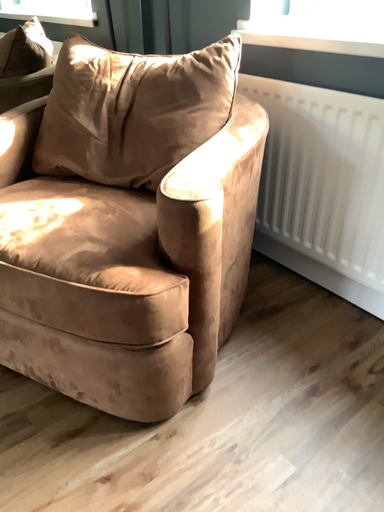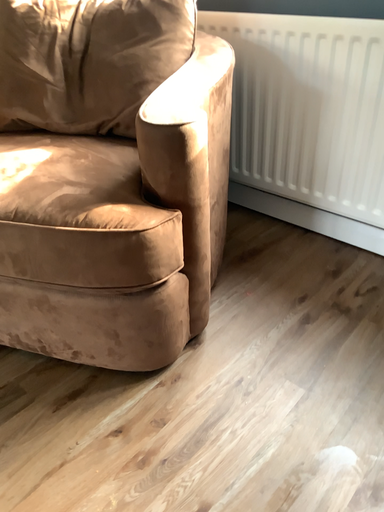
Question: How did the camera likely rotate when shooting the video?

Choices:
 (A) rotated left
 (B) rotated right

Answer: (B)